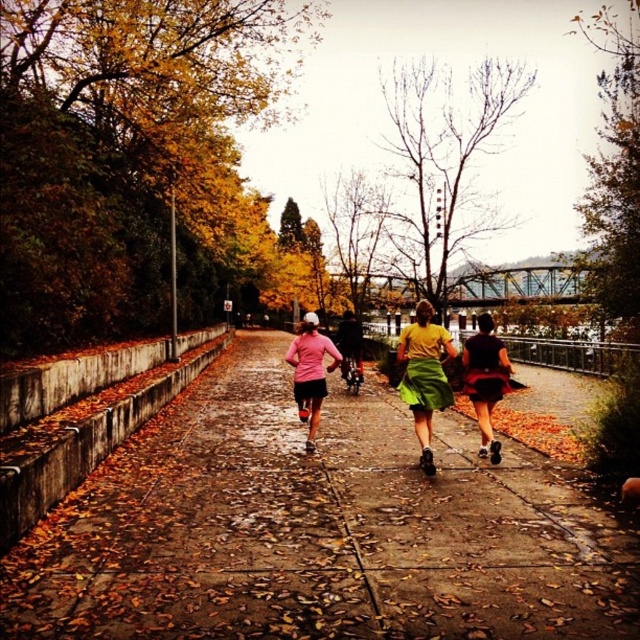
You are a photographer positioned at the end of the pathway. You want to capture a photo where both the yellow matte shirt at center and the pink matte shirt at center are clearly visible. Which person should you focus on to ensure the shorter one is in the frame?

The yellow matte shirt at center is not as tall as the pink matte shirt at center, so focusing on the pink matte shirt at center will ensure the shorter yellow matte shirt at center remains in the frame.

You are standing at the point marked as point (316,531) in the image. What material is under your feet?

The material under your feet at point (316,531) is concrete.

You are a photographer trying to capture a candid shot of the people on the pathway. You notice the yellow matte shirt at center and the matte black shorts at center. Which clothing item appears shorter in the photo?

The yellow matte shirt at center appears shorter than the matte black shorts at center in the photo.